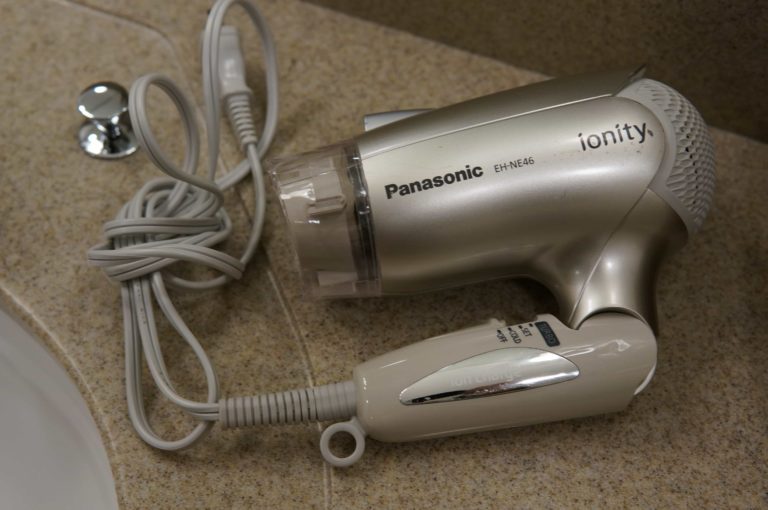
Identify the location of part you plug into outlet. The height and width of the screenshot is (510, 768). (229, 43).